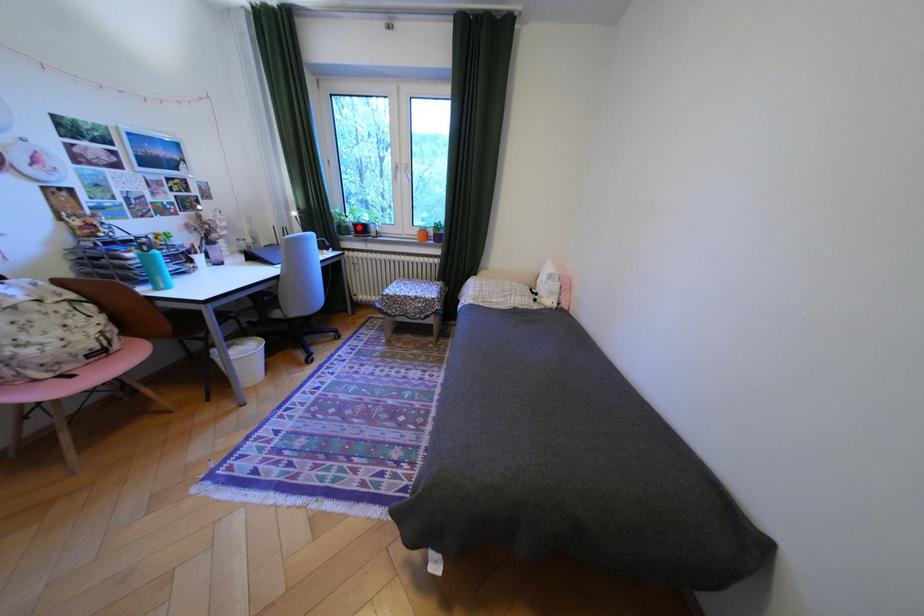
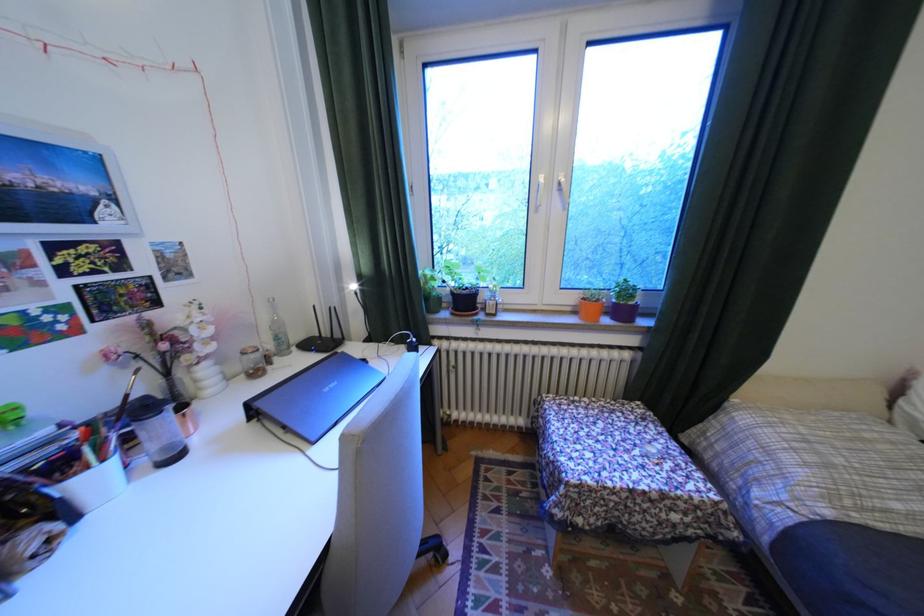
Question: I am providing you with two images of the same scene from different viewpoints. Image1 has a red point marked. In image2, the corresponding 3D location appears at what relative position? Reply with the corresponding letter.

Choices:
 (A) Closer
 (B) Farther

Answer: (B)